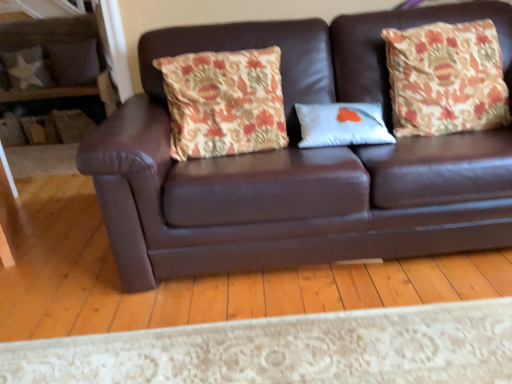
I want to click on floral fabric pillow at center, which is the first throw pillow in left-to-right order, so click(224, 102).

Describe the element at coordinates (446, 78) in the screenshot. This screenshot has width=512, height=384. I see `floral fabric pillow at right, arranged as the 1th throw pillow when viewed from the right` at that location.

How much space does camouflage fabric pillow at upper left, positioned as the first pillow in back-to-front order, occupy vertically?

15.88 inches.

The width and height of the screenshot is (512, 384). I want to click on floral fabric pillow at upper left, which is counted as the 2th pillow, starting from the back, so click(72, 62).

You are a GUI agent. You are given a task and a screenshot of the screen. Output one action in this format:
    pyautogui.click(x=<x>, y=<y>)
    Task: Click on the floral fabric pillow at center, which is the 2th throw pillow from right to left
    
    Given the screenshot: What is the action you would take?
    pyautogui.click(x=224, y=102)

In the scene shown: Considering the sizes of brown leather couch at center and camouflage fabric pillow at upper left, which appears as the second pillow when ordered from the bottom, in the image, is brown leather couch at center bigger or smaller than camouflage fabric pillow at upper left, which appears as the second pillow when ordered from the bottom,?

Considering their sizes, brown leather couch at center takes up more space than camouflage fabric pillow at upper left, which appears as the second pillow when ordered from the bottom.

Considering the sizes of objects brown leather couch at center and camouflage fabric pillow at upper left, the 3th pillow when ordered from front to back, in the image provided, who is shorter, brown leather couch at center or camouflage fabric pillow at upper left, the 3th pillow when ordered from front to back,?

camouflage fabric pillow at upper left, the 3th pillow when ordered from front to back.

From the image's perspective, is brown leather couch at center located above or below camouflage fabric pillow at upper left, the third pillow viewed from the right?

Based on their image positions, brown leather couch at center is located beneath camouflage fabric pillow at upper left, the third pillow viewed from the right.

Is point (315, 36) farther from viewer compared to point (42, 83)?

No, (315, 36) is closer to viewer.

How different are the orientations of white matte pillow at center, acting as the 3th pillow starting from the left, and floral fabric pillow at right, arranged as the 1th throw pillow when viewed from the right, in degrees?

The facing directions of white matte pillow at center, acting as the 3th pillow starting from the left, and floral fabric pillow at right, arranged as the 1th throw pillow when viewed from the right, are 3.32 degrees apart.

Is white matte pillow at center, which appears as the 1th pillow when viewed from the front, to the right of floral fabric pillow at right, arranged as the 1th throw pillow when viewed from the right, from the viewer's perspective?

No.

Does white matte pillow at center, which appears as the first pillow when ordered from the bottom, lie in front of floral fabric pillow at right, arranged as the second throw pillow when viewed from the left?

That is False.

Can you confirm if white matte pillow at center, positioned as the third pillow in back-to-front order, is wider than floral fabric pillow at right, arranged as the 1th throw pillow when viewed from the right?

No.

Is point (212, 128) positioned before point (369, 138)?

No, (212, 128) is further to viewer.

Does floral fabric pillow at center, which is the first throw pillow in left-to-right order, have a greater height compared to white matte pillow at center, positioned as the third pillow in back-to-front order?

Yes, floral fabric pillow at center, which is the first throw pillow in left-to-right order, is taller than white matte pillow at center, positioned as the third pillow in back-to-front order.

Considering the positions of objects floral fabric pillow at center, which is the 2th throw pillow from right to left, and white matte pillow at center, acting as the 3th pillow starting from the left, in the image provided, who is more to the right, floral fabric pillow at center, which is the 2th throw pillow from right to left, or white matte pillow at center, acting as the 3th pillow starting from the left,?

white matte pillow at center, acting as the 3th pillow starting from the left.

Are floral fabric pillow at center, which is the first throw pillow in left-to-right order, and white matte pillow at center, acting as the 3th pillow starting from the left, located far from each other?

No, floral fabric pillow at center, which is the first throw pillow in left-to-right order, is not far from white matte pillow at center, acting as the 3th pillow starting from the left.

Considering their positions, is floral fabric pillow at right, arranged as the second throw pillow when viewed from the left, located in front of or behind floral fabric pillow at center, which is the first throw pillow in left-to-right order?

Clearly, floral fabric pillow at right, arranged as the second throw pillow when viewed from the left, is behind floral fabric pillow at center, which is the first throw pillow in left-to-right order.

Considering the sizes of objects floral fabric pillow at right, arranged as the 1th throw pillow when viewed from the right, and floral fabric pillow at center, which is the 2th throw pillow from right to left, in the image provided, who is shorter, floral fabric pillow at right, arranged as the 1th throw pillow when viewed from the right, or floral fabric pillow at center, which is the 2th throw pillow from right to left,?

Standing shorter between the two is floral fabric pillow at center, which is the 2th throw pillow from right to left.

Considering the positions of objects floral fabric pillow at right, arranged as the second throw pillow when viewed from the left, and floral fabric pillow at center, which is the 2th throw pillow from right to left, in the image provided, who is more to the left, floral fabric pillow at right, arranged as the second throw pillow when viewed from the left, or floral fabric pillow at center, which is the 2th throw pillow from right to left,?

From the viewer's perspective, floral fabric pillow at center, which is the 2th throw pillow from right to left, appears more on the left side.

Between floral fabric pillow at right, arranged as the 1th throw pillow when viewed from the right, and floral fabric pillow at center, which is the first throw pillow in left-to-right order, which one has larger size?

floral fabric pillow at right, arranged as the 1th throw pillow when viewed from the right.

Between white matte pillow at center, which appears as the 1th pillow when viewed from the front, and floral fabric pillow at upper left, acting as the second pillow starting from the left, which one appears on the left side from the viewer's perspective?

Positioned to the left is floral fabric pillow at upper left, acting as the second pillow starting from the left.

Is white matte pillow at center, arranged as the 3th pillow when viewed from the top, inside the boundaries of floral fabric pillow at upper left, acting as the second pillow starting from the left, or outside?

white matte pillow at center, arranged as the 3th pillow when viewed from the top, is spatially situated outside floral fabric pillow at upper left, acting as the second pillow starting from the left.

The width and height of the screenshot is (512, 384). Identify the location of the 1st pillow behind the white matte pillow at center, the first pillow in the right-to-left sequence, starting your count from the anchor. (72, 62).

From the image's perspective, does white matte pillow at center, which appears as the first pillow when ordered from the bottom, appear lower than floral fabric pillow at upper left, which is the first pillow from top to bottom?

Indeed, from the image's perspective, white matte pillow at center, which appears as the first pillow when ordered from the bottom, is shown beneath floral fabric pillow at upper left, which is the first pillow from top to bottom.

From the image's perspective, is brown leather couch at center below floral fabric pillow at center, which is the 2th throw pillow from right to left?

Indeed, from the image's perspective, brown leather couch at center is shown beneath floral fabric pillow at center, which is the 2th throw pillow from right to left.

Is brown leather couch at center wider than floral fabric pillow at center, which is the 2th throw pillow from right to left?

Indeed, brown leather couch at center has a greater width compared to floral fabric pillow at center, which is the 2th throw pillow from right to left.

At what (x,y) coordinates should I click in order to perform the action: click on the 1st throw pillow above the brown leather couch at center (from the image's perspective). Please return your answer as a coordinate pair (x, y). This screenshot has width=512, height=384. Looking at the image, I should click on (224, 102).

Can we say camouflage fabric pillow at upper left, the 1th pillow from the left, lies outside floral fabric pillow at upper left, acting as the 2th pillow starting from the right?

camouflage fabric pillow at upper left, the 1th pillow from the left, is positioned outside floral fabric pillow at upper left, acting as the 2th pillow starting from the right.

You are a GUI agent. You are given a task and a screenshot of the screen. Output one action in this format:
    pyautogui.click(x=<x>, y=<y>)
    Task: Click on the pillow that is the 1st object located below the floral fabric pillow at upper left, which appears as the third pillow when ordered from the bottom (from the image's perspective)
    The height and width of the screenshot is (384, 512).
    Given the screenshot: What is the action you would take?
    pyautogui.click(x=27, y=68)

Which of these two, camouflage fabric pillow at upper left, the 3th pillow when ordered from front to back, or floral fabric pillow at upper left, acting as the second pillow starting from the left, is wider?

With larger width is camouflage fabric pillow at upper left, the 3th pillow when ordered from front to back.

From a real-world perspective, starting from the brown leather couch at center, which pillow is the 2nd one vertically above it? Please provide its 2D coordinates.

[(27, 68)]

At what (x,y) coordinates should I click in order to perform the action: click on throw pillow on the right side of white matte pillow at center, arranged as the 3th pillow when viewed from the top. Please return your answer as a coordinate pair (x, y). The width and height of the screenshot is (512, 384). Looking at the image, I should click on (446, 78).

Looking at the image, which one is located closer to white matte pillow at center, which appears as the first pillow when ordered from the bottom, floral fabric pillow at upper left, acting as the 2th pillow starting from the right, or camouflage fabric pillow at upper left, positioned as the first pillow in back-to-front order?

floral fabric pillow at upper left, acting as the 2th pillow starting from the right.

From the image, which object appears to be nearer to floral fabric pillow at center, which is the first throw pillow in left-to-right order, floral fabric pillow at upper left, acting as the 2th pillow starting from the right, or camouflage fabric pillow at upper left, positioned as the first pillow in back-to-front order?

floral fabric pillow at upper left, acting as the 2th pillow starting from the right, is closer to floral fabric pillow at center, which is the first throw pillow in left-to-right order.

From the image, which object appears to be nearer to floral fabric pillow at upper left, acting as the second pillow starting from the left, camouflage fabric pillow at upper left, the 3th pillow when ordered from front to back, or floral fabric pillow at right, arranged as the second throw pillow when viewed from the left?

Based on the image, camouflage fabric pillow at upper left, the 3th pillow when ordered from front to back, appears to be nearer to floral fabric pillow at upper left, acting as the second pillow starting from the left.

Based on their spatial positions, is floral fabric pillow at right, arranged as the 1th throw pillow when viewed from the right, or brown leather couch at center closer to floral fabric pillow at center, which is the first throw pillow in left-to-right order?

Among the two, brown leather couch at center is located nearer to floral fabric pillow at center, which is the first throw pillow in left-to-right order.

Based on their spatial positions, is floral fabric pillow at right, arranged as the second throw pillow when viewed from the left, or floral fabric pillow at center, which is the 2th throw pillow from right to left, further from camouflage fabric pillow at upper left, the third pillow viewed from the right?

floral fabric pillow at right, arranged as the second throw pillow when viewed from the left, is positioned further to the anchor camouflage fabric pillow at upper left, the third pillow viewed from the right.

Based on their spatial positions, is floral fabric pillow at center, which is the 2th throw pillow from right to left, or camouflage fabric pillow at upper left, the third pillow viewed from the right, further from floral fabric pillow at upper left, which appears as the third pillow when ordered from the bottom?

Based on the image, floral fabric pillow at center, which is the 2th throw pillow from right to left, appears to be further to floral fabric pillow at upper left, which appears as the third pillow when ordered from the bottom.

When comparing their distances from brown leather couch at center, does white matte pillow at center, arranged as the 3th pillow when viewed from the top, or camouflage fabric pillow at upper left, positioned as the first pillow in back-to-front order, seem closer?

white matte pillow at center, arranged as the 3th pillow when viewed from the top.

Considering their positions, is floral fabric pillow at upper left, acting as the 2th pillow starting from the right, positioned closer to brown leather couch at center than white matte pillow at center, arranged as the 3th pillow when viewed from the top?

The object closer to brown leather couch at center is white matte pillow at center, arranged as the 3th pillow when viewed from the top.

You are a GUI agent. You are given a task and a screenshot of the screen. Output one action in this format:
    pyautogui.click(x=<x>, y=<y>)
    Task: Click on the throw pillow located between camouflage fabric pillow at upper left, the 2th pillow when ordered from top to bottom, and white matte pillow at center, arranged as the 3th pillow when viewed from the top, in the left-right direction
    Image resolution: width=512 pixels, height=384 pixels.
    Given the screenshot: What is the action you would take?
    pyautogui.click(x=224, y=102)

I want to click on studio couch situated between camouflage fabric pillow at upper left, which appears as the second pillow when ordered from the bottom, and floral fabric pillow at right, arranged as the 1th throw pillow when viewed from the right, from left to right, so click(x=298, y=164).

Image resolution: width=512 pixels, height=384 pixels. I want to click on studio couch between white matte pillow at center, which appears as the first pillow when ordered from the bottom, and floral fabric pillow at right, arranged as the 1th throw pillow when viewed from the right, in the horizontal direction, so tap(298, 164).

Where is `pillow between brown leather couch at center and floral fabric pillow at upper left, which is the first pillow from top to bottom, from front to back`? The width and height of the screenshot is (512, 384). pillow between brown leather couch at center and floral fabric pillow at upper left, which is the first pillow from top to bottom, from front to back is located at coordinates (342, 124).